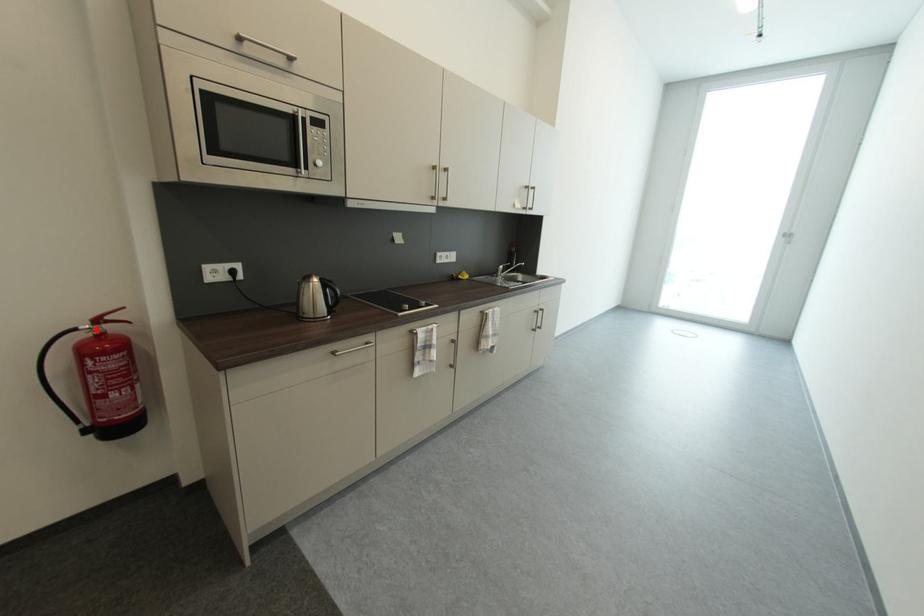
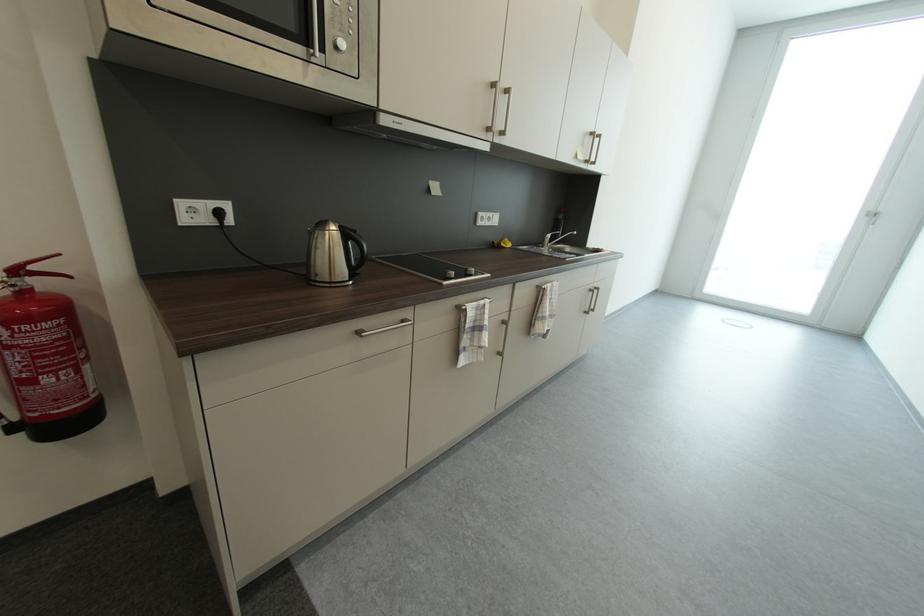
Where in the second image is the point corresponding to the highlighted location from the first image?

(8, 284)